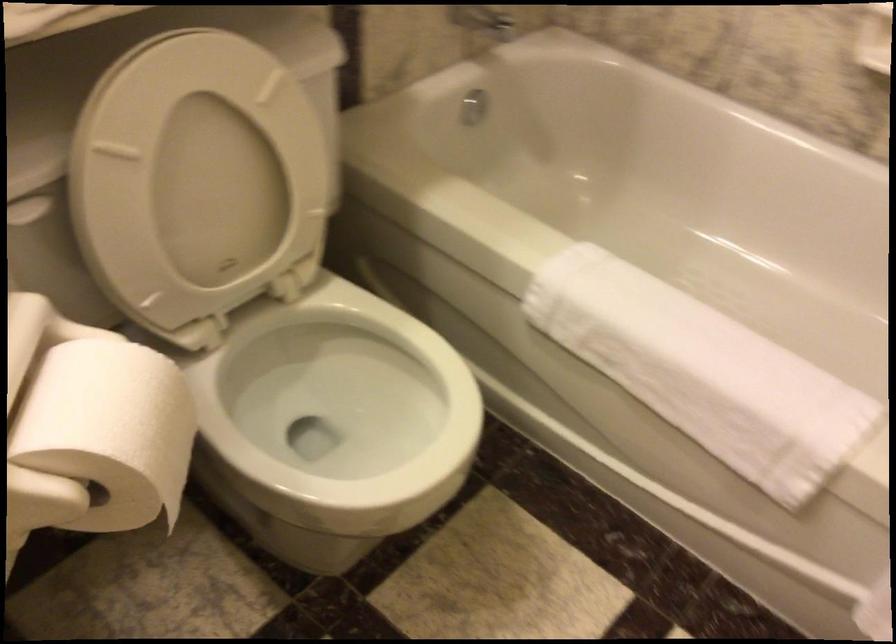
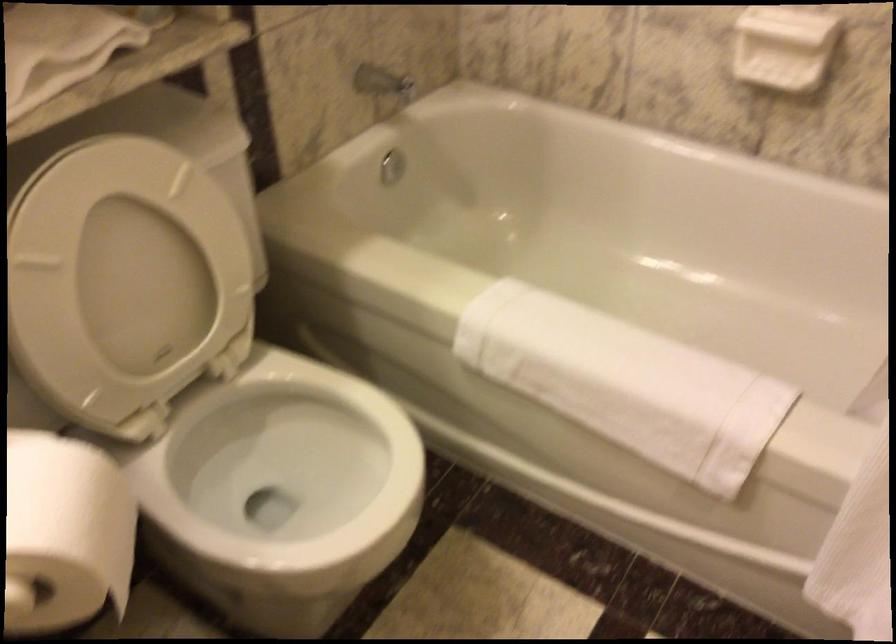
Where in the second image is the point corresponding to the point at 204,167 from the first image?

(126, 266)